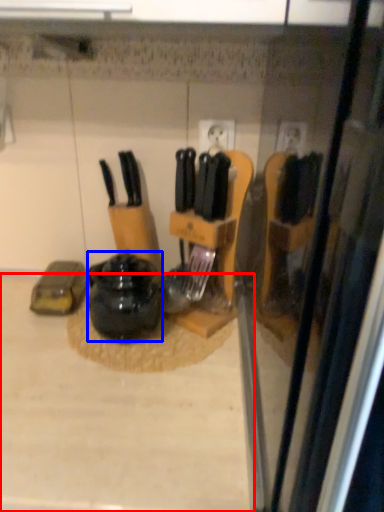
Question: Which object appears farthest to the camera in this image, counter top (highlighted by a red box) or kitchen appliance (highlighted by a blue box)?

Choices:
 (A) counter top
 (B) kitchen appliance

Answer: (B)